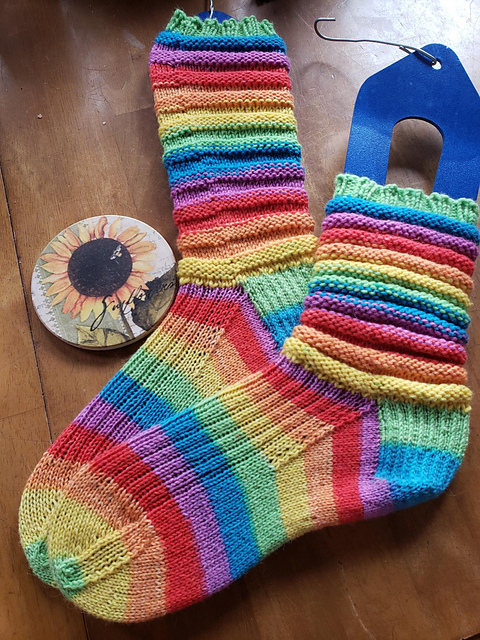
The image size is (480, 640). Find the location of `hook`. hook is located at coordinates [x=337, y=36].